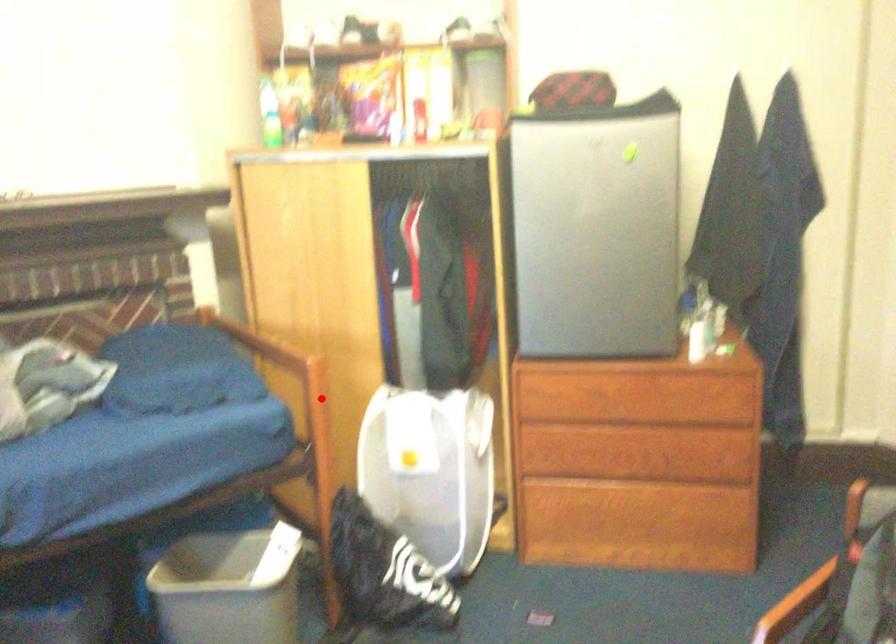
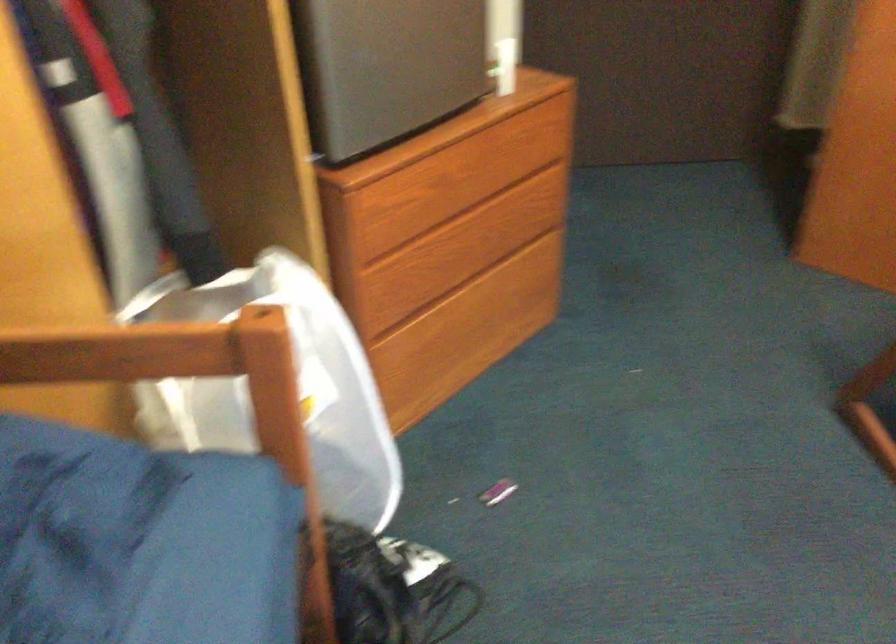
Question: I am providing you with two images of the same scene from different viewpoints. Given a red point in image1, look at the same physical point in image2. Is it:

Choices:
 (A) Closer to the viewpoint
 (B) Farther from the viewpoint

Answer: (A)